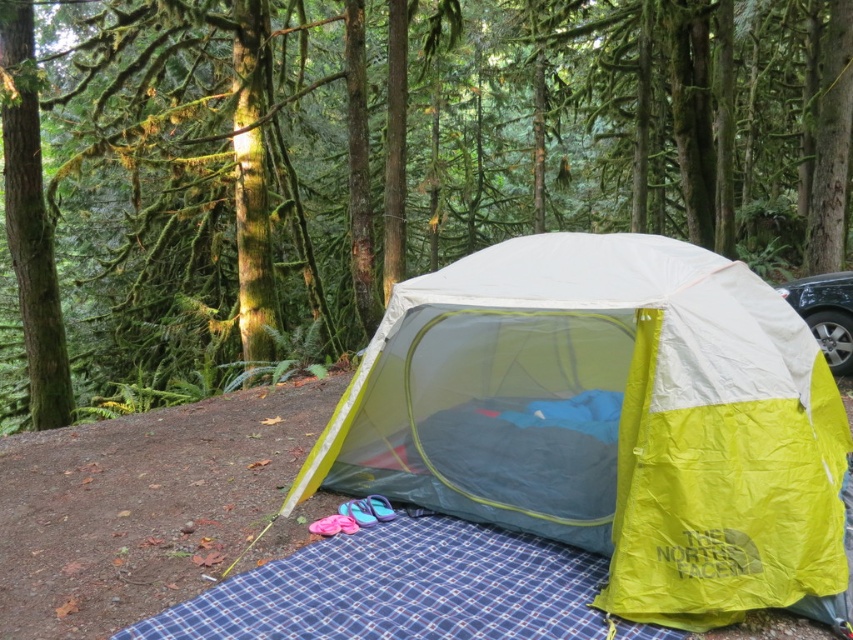
Can you confirm if green mossy bark tree at upper left is smaller than metallic gray car at right?

Incorrect, green mossy bark tree at upper left is not smaller in size than metallic gray car at right.

Can you confirm if green mossy bark tree at upper left is positioned to the right of metallic gray car at right?

In fact, green mossy bark tree at upper left is to the left of metallic gray car at right.

What are the coordinates of `green mossy bark tree at upper left` in the screenshot? It's located at (32, 224).

Who is higher up, yellow fabric tent at center or green mossy bark tree at upper left?

green mossy bark tree at upper left is higher up.

Between yellow fabric tent at center and green mossy bark tree at upper left, which one is positioned lower?

Positioned lower is yellow fabric tent at center.

Measure the distance between yellow fabric tent at center and camera.

yellow fabric tent at center and camera are 2.77 meters apart.

The height and width of the screenshot is (640, 853). I want to click on yellow fabric tent at center, so click(608, 419).

At what (x,y) coordinates should I click in order to perform the action: click on green mossy tree at center. Please return your answer as a coordinate pair (x, y). Looking at the image, I should click on (379, 166).

Based on the photo, is green mossy tree at center to the left of yellow fabric tent at center from the viewer's perspective?

In fact, green mossy tree at center is to the right of yellow fabric tent at center.

Does point (840, 193) lie in front of point (721, 536)?

No, it is not.

Find the location of a particular element. The width and height of the screenshot is (853, 640). green mossy tree at center is located at coordinates (379, 166).